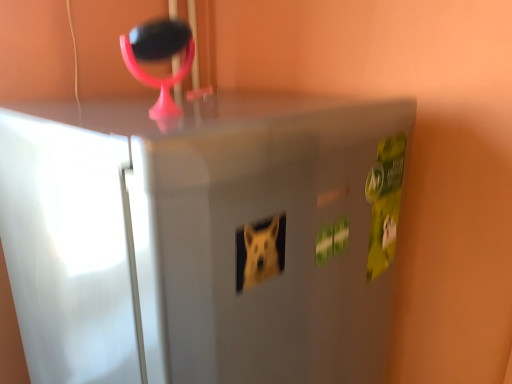
Consider the image. In order to face satin silver fridge at center, should I rotate leftwards or rightwards?

It's best to rotate left around 5.459 degrees.

The width and height of the screenshot is (512, 384). In order to click on satin silver fridge at center in this screenshot , I will do `click(203, 240)`.

This screenshot has height=384, width=512. What do you see at coordinates (203, 240) in the screenshot?
I see `satin silver fridge at center` at bounding box center [203, 240].

The height and width of the screenshot is (384, 512). What do you see at coordinates (159, 58) in the screenshot? I see `pink plastic magnifying glass at upper center` at bounding box center [159, 58].

The width and height of the screenshot is (512, 384). Find the location of `pink plastic magnifying glass at upper center`. pink plastic magnifying glass at upper center is located at coordinates (159, 58).

Where is `satin silver fridge at center`? satin silver fridge at center is located at coordinates (203, 240).

Can you confirm if pink plastic magnifying glass at upper center is positioned to the left of satin silver fridge at center?

Correct, you'll find pink plastic magnifying glass at upper center to the left of satin silver fridge at center.

Is pink plastic magnifying glass at upper center in front of satin silver fridge at center?

No, pink plastic magnifying glass at upper center is behind satin silver fridge at center.

Considering the positions of point (178, 76) and point (60, 143), is point (178, 76) closer or farther from the camera than point (60, 143)?

Point (178, 76) is farther from the camera than point (60, 143).

From the image's perspective, is pink plastic magnifying glass at upper center located beneath satin silver fridge at center?

No, from the image's perspective, pink plastic magnifying glass at upper center is not below satin silver fridge at center.

From a real-world perspective, is pink plastic magnifying glass at upper center below satin silver fridge at center?

Actually, pink plastic magnifying glass at upper center is physically above satin silver fridge at center in the real world.

Based on the photo, can you confirm if pink plastic magnifying glass at upper center is thinner than satin silver fridge at center?

Correct, the width of pink plastic magnifying glass at upper center is less than that of satin silver fridge at center.

Considering the sizes of objects pink plastic magnifying glass at upper center and satin silver fridge at center in the image provided, who is taller, pink plastic magnifying glass at upper center or satin silver fridge at center?

With more height is satin silver fridge at center.

From the picture: Which of these two, pink plastic magnifying glass at upper center or satin silver fridge at center, is bigger?

satin silver fridge at center is bigger.

Is satin silver fridge at center located within pink plastic magnifying glass at upper center?

No, satin silver fridge at center is not surrounded by pink plastic magnifying glass at upper center.

Is pink plastic magnifying glass at upper center in contact with satin silver fridge at center?

No, pink plastic magnifying glass at upper center is not in contact with satin silver fridge at center.

Could you tell me if pink plastic magnifying glass at upper center is facing satin silver fridge at center?

No, pink plastic magnifying glass at upper center is not oriented towards satin silver fridge at center.

Can you tell me how much pink plastic magnifying glass at upper center and satin silver fridge at center differ in facing direction?

2.3 degrees separate the facing orientations of pink plastic magnifying glass at upper center and satin silver fridge at center.

At what (x,y) coordinates should I click in order to perform the action: click on magnifying glass that appears above the satin silver fridge at center (from a real-world perspective). Please return your answer as a coordinate pair (x, y). This screenshot has height=384, width=512. Looking at the image, I should click on (159, 58).

Considering the relative positions of satin silver fridge at center and pink plastic magnifying glass at upper center in the image provided, is satin silver fridge at center to the left of pink plastic magnifying glass at upper center from the viewer's perspective?

In fact, satin silver fridge at center is to the right of pink plastic magnifying glass at upper center.

Does satin silver fridge at center lie in front of pink plastic magnifying glass at upper center?

Yes, satin silver fridge at center is closer to the viewer.

Is point (230, 284) in front of point (182, 67)?

Yes, point (230, 284) is in front of point (182, 67).

From the image's perspective, is satin silver fridge at center on top of pink plastic magnifying glass at upper center?

No, from the image's perspective, satin silver fridge at center is not over pink plastic magnifying glass at upper center.

From a real-world perspective, is satin silver fridge at center under pink plastic magnifying glass at upper center?

Yes, from a real-world perspective, satin silver fridge at center is beneath pink plastic magnifying glass at upper center.

Looking at their sizes, would you say satin silver fridge at center is wider or thinner than pink plastic magnifying glass at upper center?

Clearly, satin silver fridge at center has more width compared to pink plastic magnifying glass at upper center.

Does satin silver fridge at center have a lesser height compared to pink plastic magnifying glass at upper center?

No, satin silver fridge at center is not shorter than pink plastic magnifying glass at upper center.

Considering the sizes of objects satin silver fridge at center and pink plastic magnifying glass at upper center in the image provided, who is smaller, satin silver fridge at center or pink plastic magnifying glass at upper center?

With smaller size is pink plastic magnifying glass at upper center.

Is satin silver fridge at center not within pink plastic magnifying glass at upper center?

Indeed, satin silver fridge at center is completely outside pink plastic magnifying glass at upper center.

Is satin silver fridge at center directly adjacent to pink plastic magnifying glass at upper center?

No, satin silver fridge at center is not beside pink plastic magnifying glass at upper center.

Is satin silver fridge at center oriented towards pink plastic magnifying glass at upper center?

No, satin silver fridge at center is not facing towards pink plastic magnifying glass at upper center.

You are a GUI agent. You are given a task and a screenshot of the screen. Output one action in this format:
    pyautogui.click(x=<x>, y=<y>)
    Task: Click on the magnifying glass behind the satin silver fridge at center
    The image size is (512, 384).
    Given the screenshot: What is the action you would take?
    pyautogui.click(x=159, y=58)

Where is `refrigerator located in front of the pink plastic magnifying glass at upper center`? refrigerator located in front of the pink plastic magnifying glass at upper center is located at coordinates (203, 240).

Locate an element on the screen. The width and height of the screenshot is (512, 384). magnifying glass that is on the left side of satin silver fridge at center is located at coordinates (159, 58).